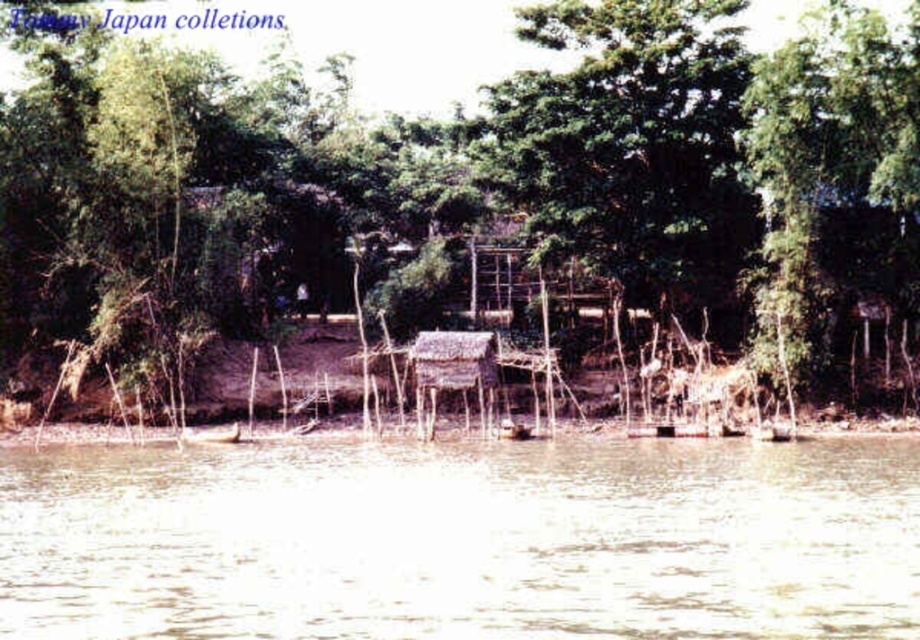
You are standing at the riverside and see two points marked in the image. Which point is closer to you, point (539, 4) or point (483, 474)?

Point (539, 4) is closer to you because it is further to the viewer than point (483, 474).

You are standing at the edge of the river and want to take a photo of the green leafy tree at center. Which direction should you face to capture it in your view?

The green leafy tree at center is located at point coordinates, so you should face towards the center of the scene to capture it in your photo.